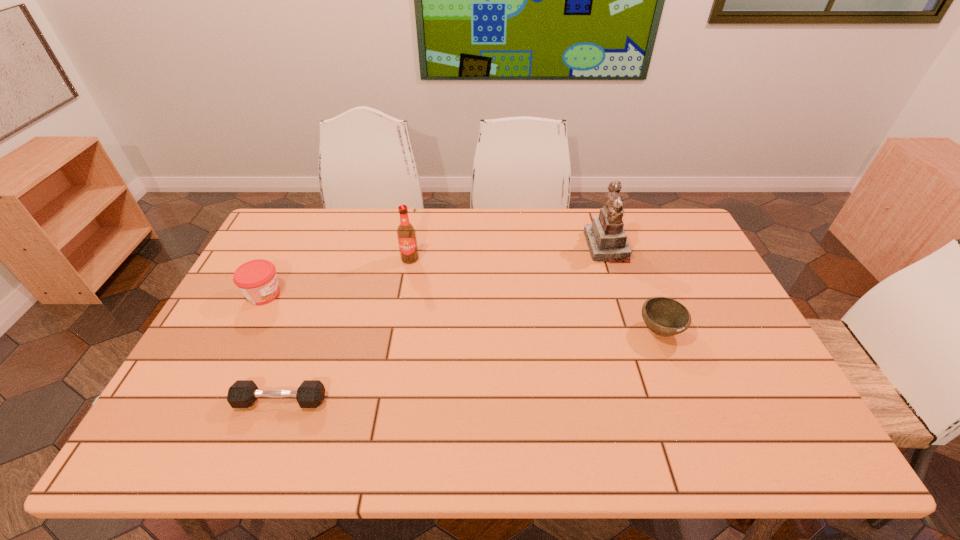
Locate an element on the screen. figurine is located at coordinates (607, 241).

At what (x,y) coordinates should I click in order to perform the action: click on the fourth shortest object. Please return your answer as a coordinate pair (x, y). Image resolution: width=960 pixels, height=540 pixels. Looking at the image, I should click on (406, 234).

I want to click on the third object from right to left, so click(406, 234).

This screenshot has height=540, width=960. What are the coordinates of `the leftmost object` in the screenshot? It's located at pyautogui.click(x=257, y=280).

Locate an element on the screen. This screenshot has width=960, height=540. the third farthest object is located at coordinates (257, 280).

The height and width of the screenshot is (540, 960). Find the location of `the fourth tallest object`. the fourth tallest object is located at coordinates (664, 316).

I want to click on bowl, so click(664, 316).

This screenshot has width=960, height=540. Identify the location of dumbbell. 243,393.

The image size is (960, 540). In order to click on the shortest object in this screenshot , I will do `click(243, 393)`.

Locate an element on the screen. The image size is (960, 540). free space located 0.290m on the front-facing side of the figurine is located at coordinates (501, 246).